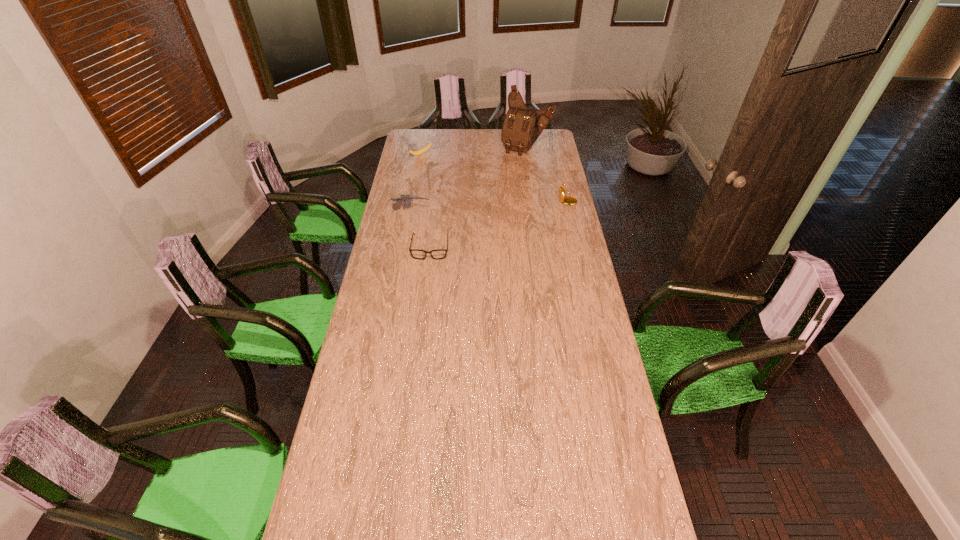
Image resolution: width=960 pixels, height=540 pixels. What are the coordinates of `vacant space on the desktop that is between the nearest object and the third farthest object and is positioned at the barrel of the gun` in the screenshot? It's located at (495, 225).

This screenshot has width=960, height=540. I want to click on vacant spot on the desktop that is between the spectacles and the third farthest object and is positioned on the front-facing side of the tallest object, so click(x=483, y=230).

Locate an element on the screen. This screenshot has width=960, height=540. free space on the desktop that is between the nearest object and the third nearest object and is positioned on the upward curve of the banana is located at coordinates (513, 219).